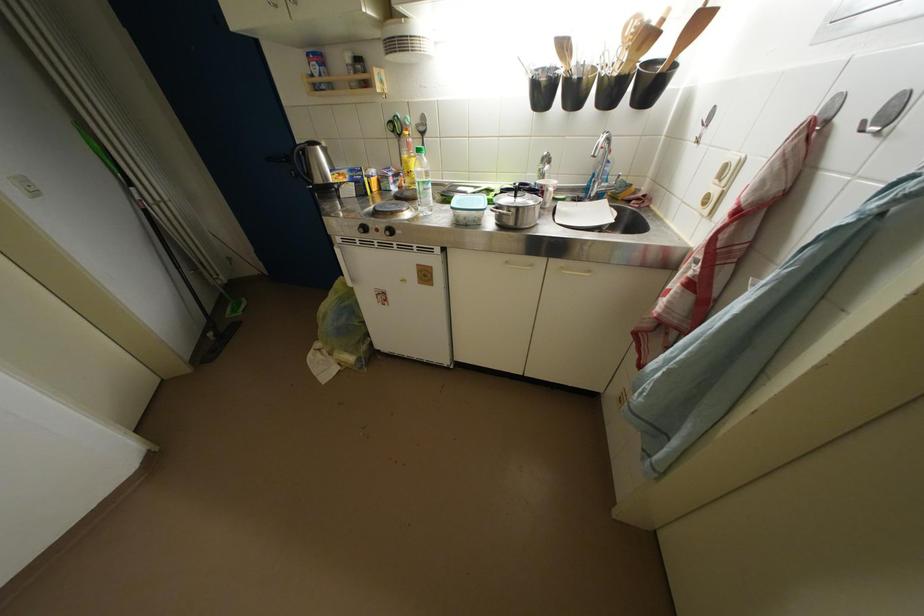
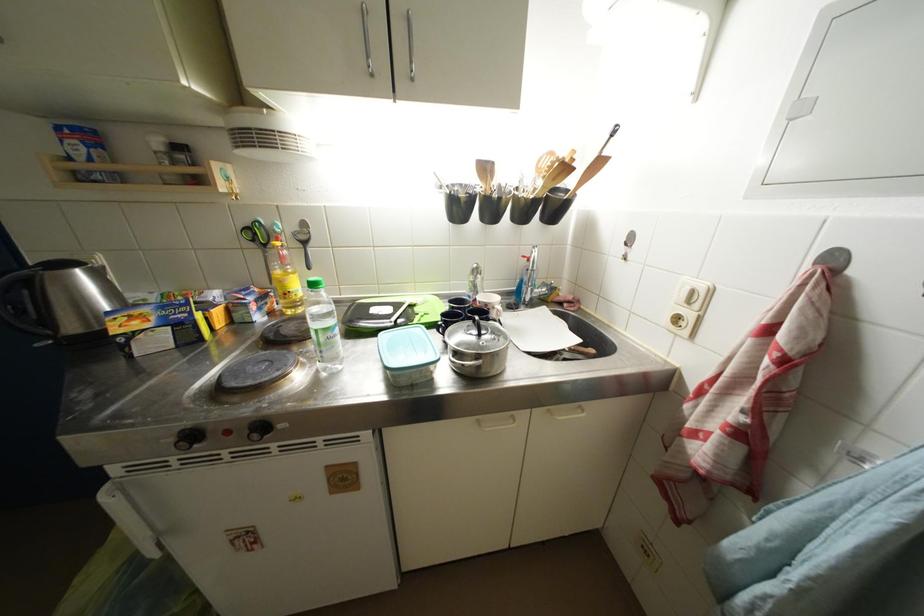
The point at (550, 179) is marked in the first image. Where is the corresponding point in the second image?

(481, 291)